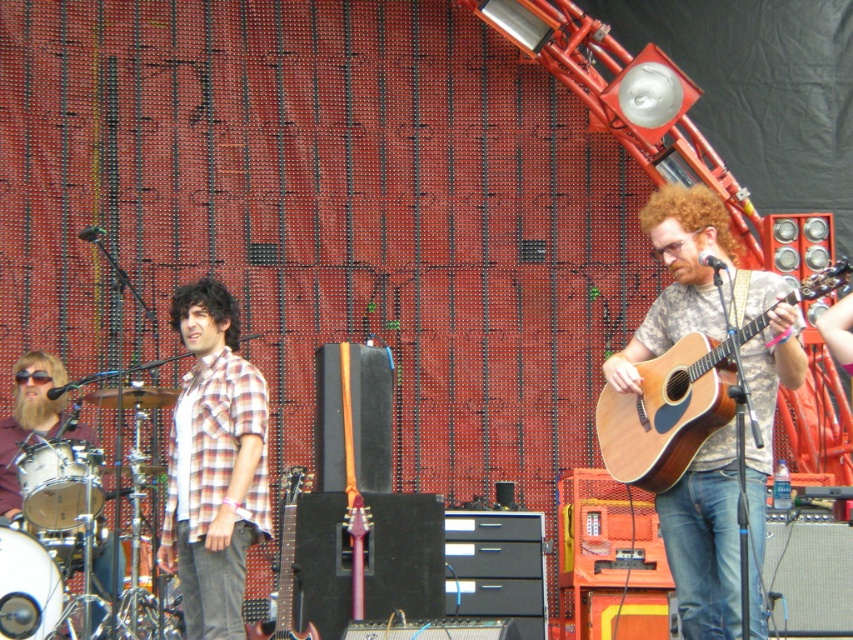
Question: Among these objects, which one is nearest to the camera?

Choices:
 (A) wooden acoustic guitar at right
 (B) glossy wood guitar at center
 (C) natural wood acoustic guitar at right

Answer: (C)

Question: Can you confirm if wooden acoustic guitar at right is smaller than natural wood acoustic guitar at right?

Choices:
 (A) yes
 (B) no

Answer: (B)

Question: Does plaid cotton shirt at center come in front of glossy wood guitar at center?

Choices:
 (A) no
 (B) yes

Answer: (B)

Question: Based on their relative distances, which object is nearer to the plaid cotton shirt at center?

Choices:
 (A) glossy wood guitar at center
 (B) natural wood acoustic guitar at right

Answer: (A)

Question: Does natural wood acoustic guitar at right have a lesser width compared to glossy wood guitar at center?

Choices:
 (A) yes
 (B) no

Answer: (B)

Question: Which point is closer to the camera?

Choices:
 (A) (706, 634)
 (B) (274, 624)
 (C) (648, 470)

Answer: (A)